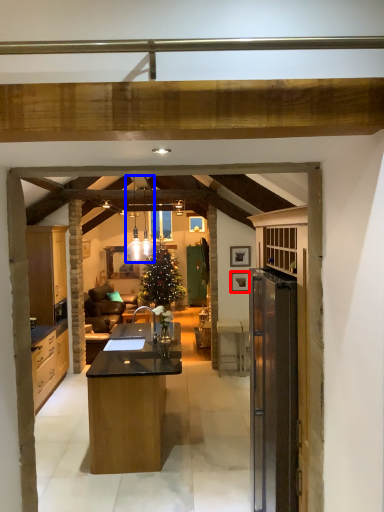
Question: Which object is further to the camera taking this photo, picture frame (highlighted by a red box) or lamp (highlighted by a blue box)?

Choices:
 (A) picture frame
 (B) lamp

Answer: (A)